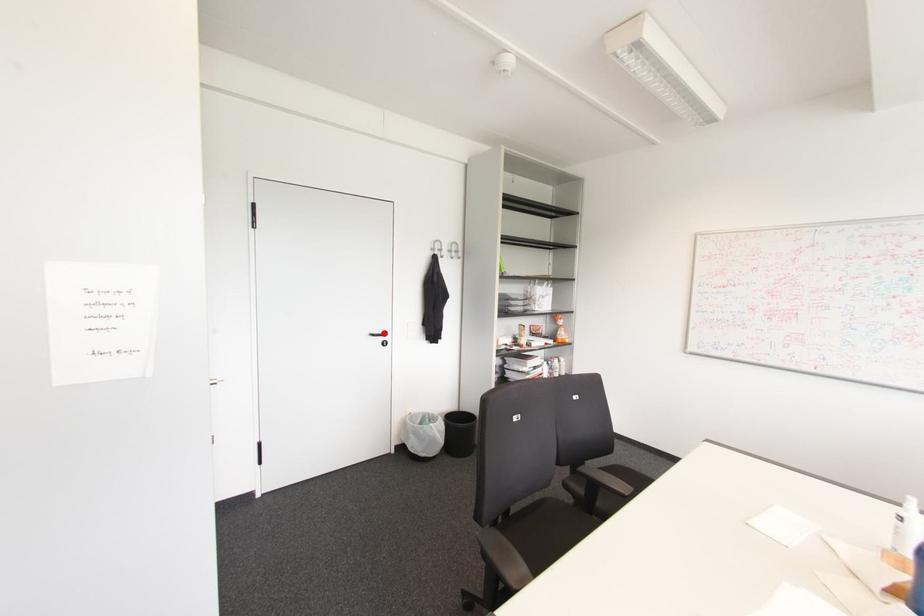
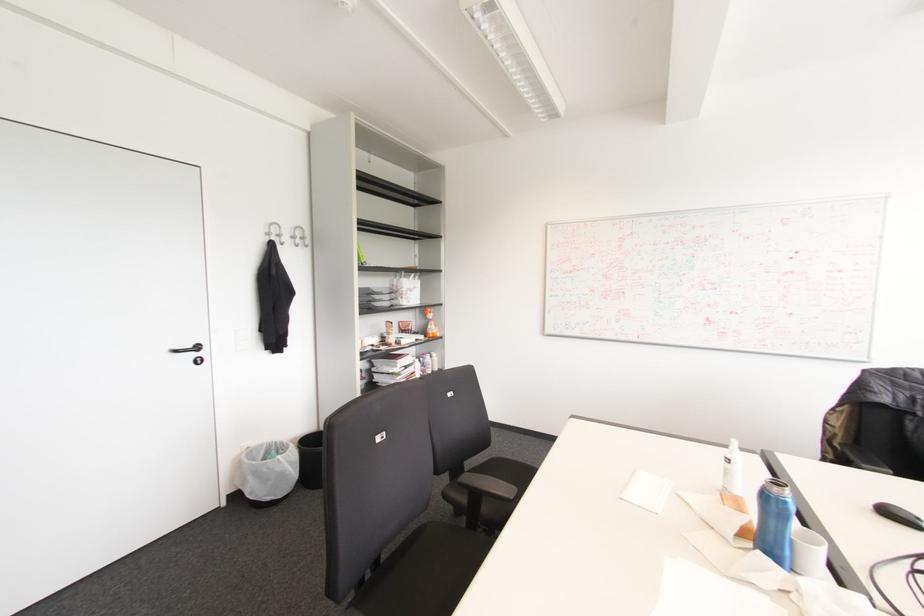
Where in the second image is the point corresponding to the highlighted location from the first image?

(197, 347)